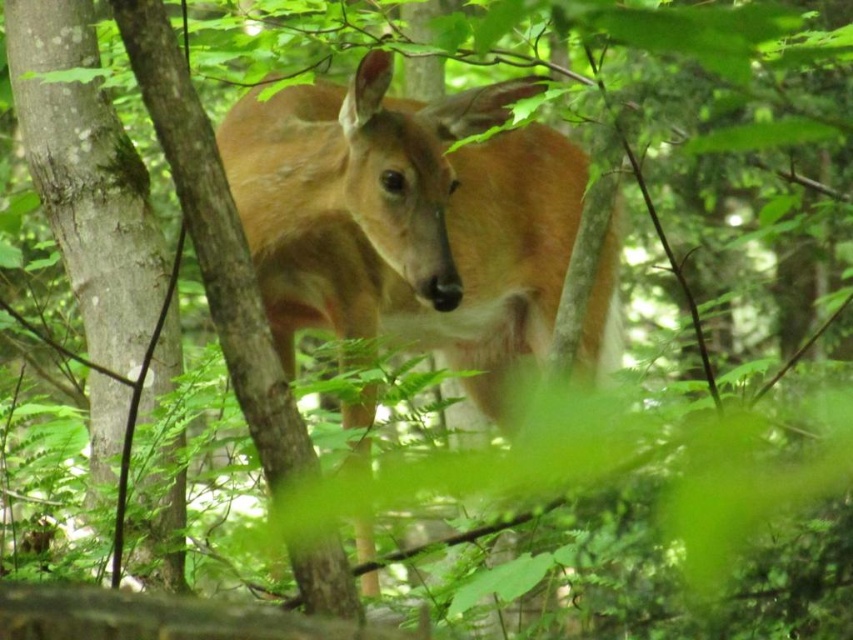
Question: Which object appears closest to the camera in this image?

Choices:
 (A) smooth bark tree at center
 (B) brown velvet deer at center

Answer: (B)

Question: Which object is closer to the camera taking this photo?

Choices:
 (A) smooth bark tree at center
 (B) brown velvet deer at center

Answer: (B)

Question: Is brown velvet deer at center positioned at the back of smooth bark tree at center?

Choices:
 (A) no
 (B) yes

Answer: (A)

Question: Which point is farther to the camera?

Choices:
 (A) (257, 240)
 (B) (30, 67)

Answer: (B)

Question: Is brown velvet deer at center above smooth bark tree at center?

Choices:
 (A) yes
 (B) no

Answer: (A)

Question: Is brown velvet deer at center wider than smooth bark tree at center?

Choices:
 (A) no
 (B) yes

Answer: (B)